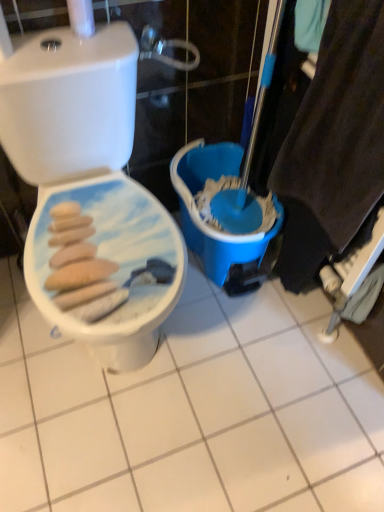
This screenshot has width=384, height=512. I want to click on vacant area that is in front of blue plastic bucket at center, so click(x=231, y=344).